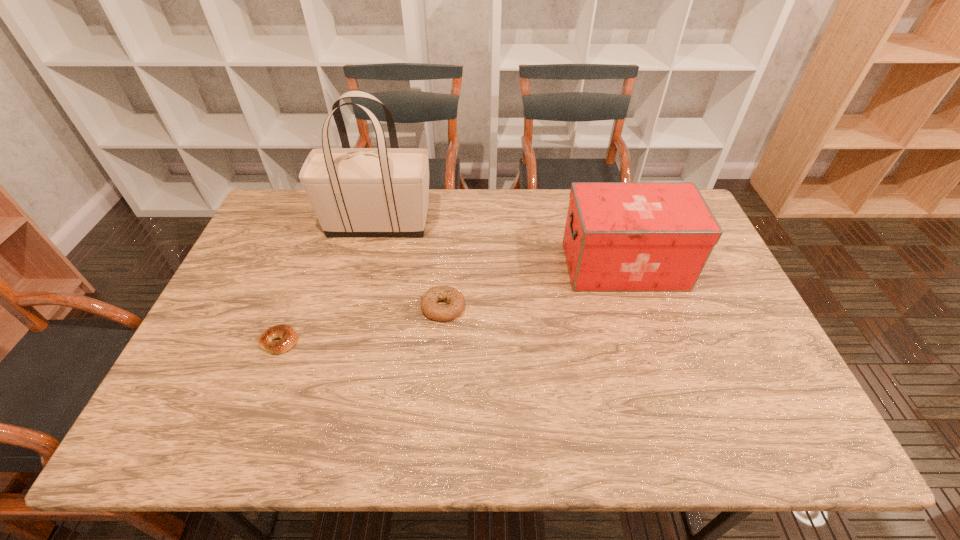
This screenshot has width=960, height=540. What are the coordinates of `object that ranks as the third closest to the shopping bag` in the screenshot? It's located at (619, 236).

Locate an element on the screen. The width and height of the screenshot is (960, 540). object that stands as the closest to the third shortest object is located at coordinates (454, 298).

Image resolution: width=960 pixels, height=540 pixels. Identify the location of blank area in the image that satisfies the following two spatial constraints: 1. with handles facing forward on the shopping bag; 2. on the front side of the nearer bagel. (348, 341).

This screenshot has height=540, width=960. I want to click on vacant space that satisfies the following two spatial constraints: 1. on the handle side of the rightmost object; 2. on the front side of the taller bagel, so click(637, 307).

This screenshot has width=960, height=540. Find the location of `vacant space that satisfies the following two spatial constraints: 1. with handles facing forward on the tallest object; 2. on the left side of the right bagel`. vacant space that satisfies the following two spatial constraints: 1. with handles facing forward on the tallest object; 2. on the left side of the right bagel is located at coordinates (358, 307).

Where is `free spot that satisfies the following two spatial constraints: 1. with handles facing forward on the third tallest object; 2. on the right side of the shopping bag`? free spot that satisfies the following two spatial constraints: 1. with handles facing forward on the third tallest object; 2. on the right side of the shopping bag is located at coordinates 358,307.

Locate an element on the screen. The width and height of the screenshot is (960, 540). blank space that satisfies the following two spatial constraints: 1. with handles facing forward on the farthest object; 2. on the back side of the third tallest object is located at coordinates (358, 307).

In order to click on free space in the image that satisfies the following two spatial constraints: 1. on the handle side of the rightmost object; 2. on the front side of the nearer bagel in this screenshot , I will do `click(648, 341)`.

This screenshot has height=540, width=960. What are the coordinates of `free space that satisfies the following two spatial constraints: 1. with handles facing forward on the shopping bag; 2. on the left side of the second shortest object` in the screenshot? It's located at (358, 307).